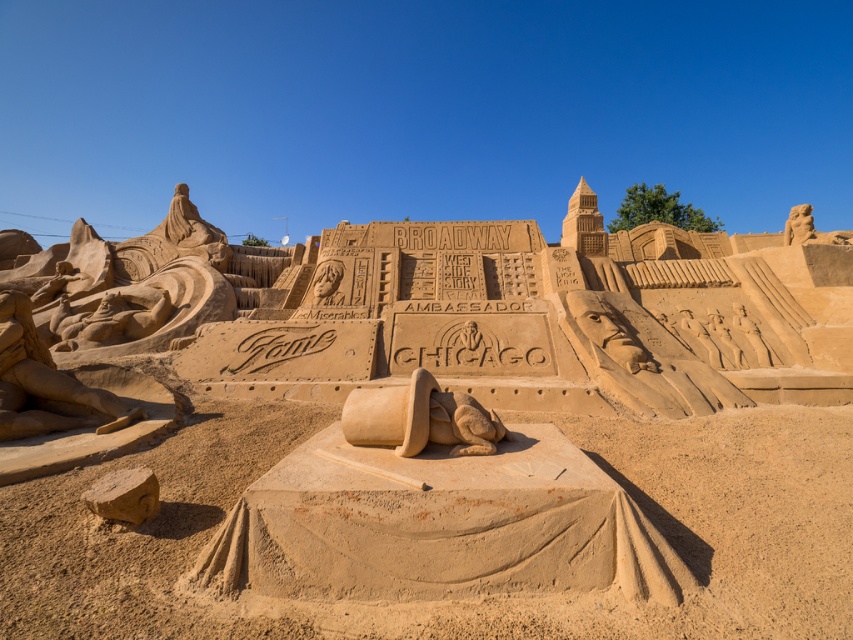
Question: Among these points, which one is farthest from the camera?

Choices:
 (A) (715, 540)
 (B) (413, 452)
 (C) (805, 211)

Answer: (C)

Question: Where is smooth sand figure at left located in relation to smooth sand statue at upper right in the image?

Choices:
 (A) right
 (B) left

Answer: (B)

Question: In this image, where is smooth sand face at center located relative to smooth sand statue at center?

Choices:
 (A) above
 (B) below

Answer: (B)

Question: Based on their relative distances, which object is nearer to the smooth sand hat at center?

Choices:
 (A) smooth sand statue at center
 (B) smooth sand statue at upper right
 (C) smooth sand at center
 (D) smooth sand figure at left

Answer: (C)

Question: Does smooth sand figure at left appear over smooth sand figure at center-right?

Choices:
 (A) no
 (B) yes

Answer: (A)

Question: Which object is farther from the camera taking this photo?

Choices:
 (A) smooth sand figure at left
 (B) smooth sand hat at center
 (C) smooth sand at center

Answer: (A)